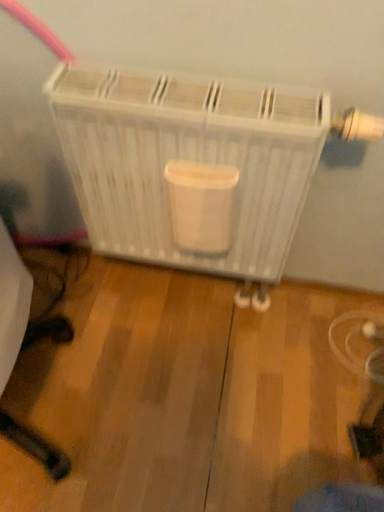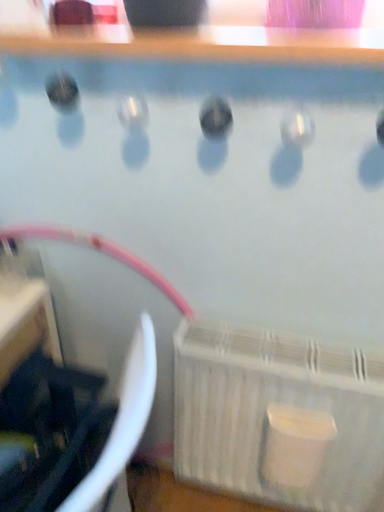
Question: Which way did the camera rotate in the video?

Choices:
 (A) rotated upward
 (B) rotated downward

Answer: (A)